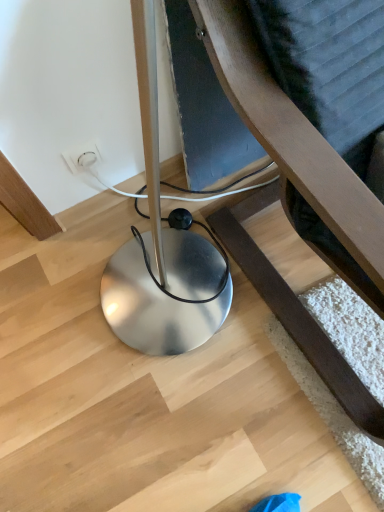
Question: Is metallic silver lamp at lower left wider than white plastic outlet at center?

Choices:
 (A) yes
 (B) no

Answer: (A)

Question: Is metallic silver lamp at lower left bigger than white plastic outlet at center?

Choices:
 (A) no
 (B) yes

Answer: (B)

Question: Considering the relative sizes of metallic silver lamp at lower left and white plastic outlet at center in the image provided, is metallic silver lamp at lower left shorter than white plastic outlet at center?

Choices:
 (A) no
 (B) yes

Answer: (A)

Question: Is metallic silver lamp at lower left at the right side of white plastic outlet at center?

Choices:
 (A) yes
 (B) no

Answer: (A)

Question: Is metallic silver lamp at lower left positioned with its back to white plastic outlet at center?

Choices:
 (A) no
 (B) yes

Answer: (A)

Question: Does metallic silver lamp at lower left lie in front of white plastic outlet at center?

Choices:
 (A) no
 (B) yes

Answer: (B)

Question: Considering the relative sizes of white plastic outlet at center and metallic silver lamp at lower left in the image provided, is white plastic outlet at center smaller than metallic silver lamp at lower left?

Choices:
 (A) yes
 (B) no

Answer: (A)

Question: Does white plastic outlet at center appear on the right side of metallic silver lamp at lower left?

Choices:
 (A) yes
 (B) no

Answer: (B)

Question: Does white plastic outlet at center have a greater width compared to metallic silver lamp at lower left?

Choices:
 (A) yes
 (B) no

Answer: (B)

Question: From a real-world perspective, is white plastic outlet at center on top of metallic silver lamp at lower left?

Choices:
 (A) no
 (B) yes

Answer: (A)

Question: Is white plastic outlet at center far from metallic silver lamp at lower left?

Choices:
 (A) yes
 (B) no

Answer: (B)

Question: Does white plastic outlet at center lie behind metallic silver lamp at lower left?

Choices:
 (A) no
 (B) yes

Answer: (B)

Question: Is white plastic outlet at center spatially inside metallic silver lamp at lower left, or outside of it?

Choices:
 (A) outside
 (B) inside

Answer: (A)